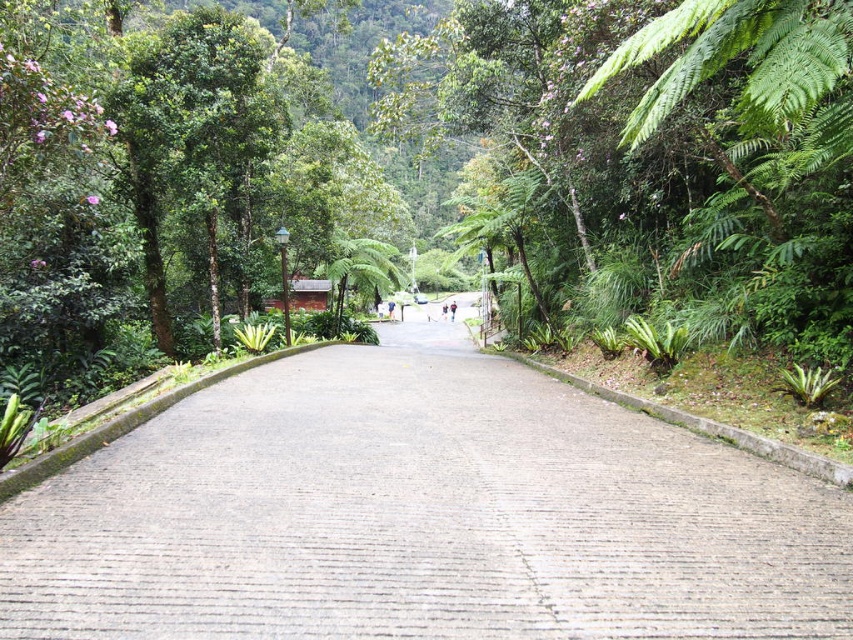
Consider the image. You are a hiker walking along the gray concrete path at center and the light brown skin at center. Which object is bigger in size?

The gray concrete path at center is larger in size than the light brown skin at center.